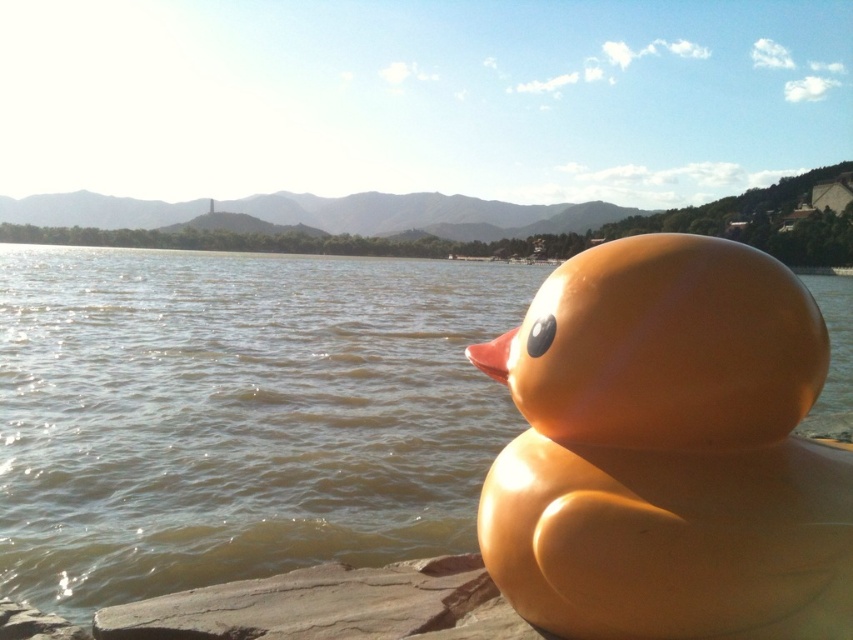
What do you see at coordinates (238, 413) in the screenshot? The height and width of the screenshot is (640, 853). I see `translucent water at duck right` at bounding box center [238, 413].

Which is in front, point (245, 536) or point (515, 515)?

Point (515, 515) is more forward.

Where is `translucent water at duck right`? This screenshot has width=853, height=640. translucent water at duck right is located at coordinates (238, 413).